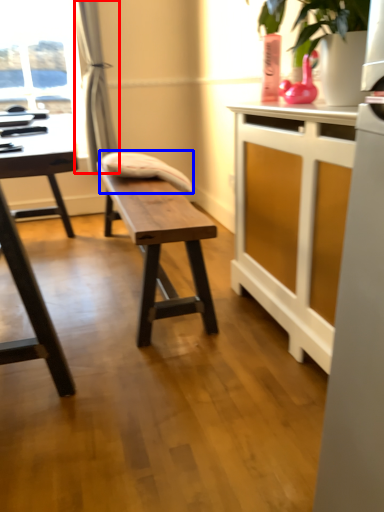
Question: Among these objects, which one is nearest to the camera, curtain (highlighted by a red box) or swivel chair (highlighted by a blue box)?

Choices:
 (A) curtain
 (B) swivel chair

Answer: (B)